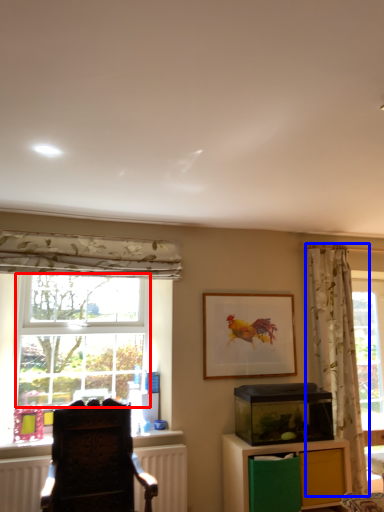
Question: Which of the following is the closest to the observer, bay window (highlighted by a red box) or curtain (highlighted by a blue box)?

Choices:
 (A) bay window
 (B) curtain

Answer: (B)